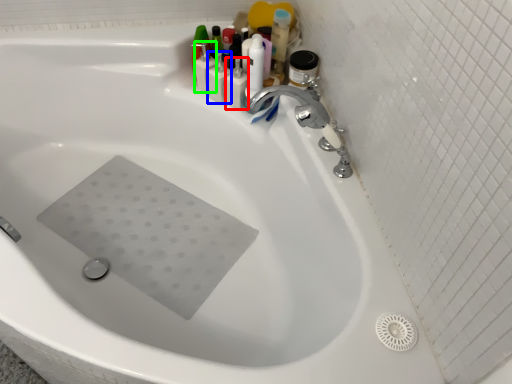
Question: Considering the real-world distances, which object is closest to toiletry (highlighted by a red box)? toiletry (highlighted by a blue box) or toiletry (highlighted by a green box).

Choices:
 (A) toiletry
 (B) toiletry

Answer: (A)